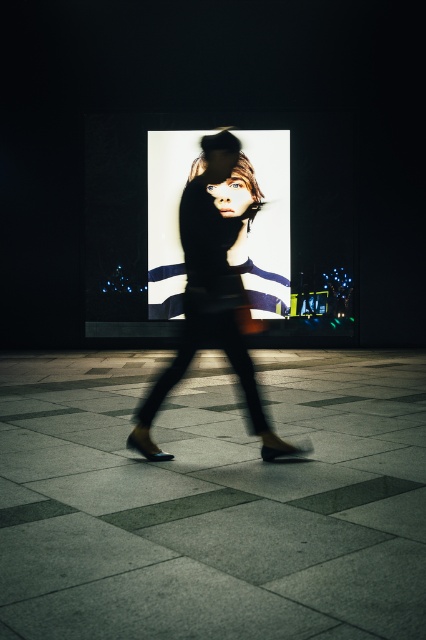
Does silky black dress at center appear over matte black portrait at center?

No, silky black dress at center is not above matte black portrait at center.

Looking at this image, can you confirm if silky black dress at center is bigger than matte black portrait at center?

No, silky black dress at center is not bigger than matte black portrait at center.

In order to click on silky black dress at center in this screenshot , I will do `click(213, 291)`.

Does dark gray concrete pavement at center appear over silky black dress at center?

Actually, dark gray concrete pavement at center is below silky black dress at center.

Is dark gray concrete pavement at center shorter than silky black dress at center?

Yes.

Where is `dark gray concrete pavement at center`? This screenshot has height=640, width=426. dark gray concrete pavement at center is located at coordinates (213, 499).

Can you confirm if dark gray concrete pavement at center is taller than matte black portrait at center?

In fact, dark gray concrete pavement at center may be shorter than matte black portrait at center.

Measure the distance between dark gray concrete pavement at center and camera.

2.51 meters

Does point (296, 592) come farther from viewer compared to point (164, 285)?

No.

Locate an element on the screen. dark gray concrete pavement at center is located at coordinates (213, 499).